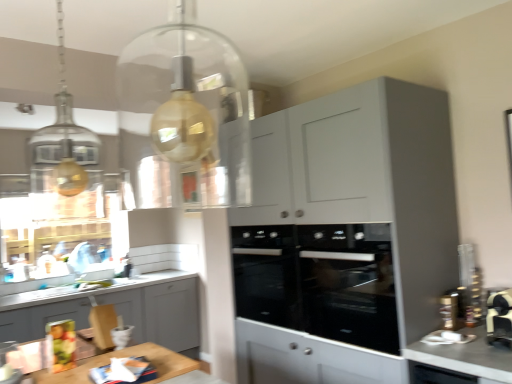
Question: Are matte gray cabinet at lower left, the 1th cabinetry when ordered from back to front, and white glossy countertop at lower right located far from each other?

Choices:
 (A) no
 (B) yes

Answer: (B)

Question: From a real-world perspective, does matte gray cabinet at lower left, the first cabinetry viewed from the left, sit lower than white glossy countertop at lower right?

Choices:
 (A) yes
 (B) no

Answer: (A)

Question: Is white glossy countertop at lower right a part of matte gray cabinet at lower left, the 1th cabinetry when ordered from back to front?

Choices:
 (A) no
 (B) yes

Answer: (A)

Question: Considering the relative sizes of matte gray cabinet at lower left, which ranks as the 2th cabinetry in right-to-left order, and white glossy countertop at lower right in the image provided, is matte gray cabinet at lower left, which ranks as the 2th cabinetry in right-to-left order, taller than white glossy countertop at lower right?

Choices:
 (A) no
 (B) yes

Answer: (B)

Question: Is matte gray cabinet at lower left, which ranks as the 2th cabinetry in right-to-left order, smaller than white glossy countertop at lower right?

Choices:
 (A) no
 (B) yes

Answer: (A)

Question: From a real-world perspective, relative to black glass oven at center, is black glass oven at center vertically above or below?

Choices:
 (A) above
 (B) below

Answer: (B)

Question: Does point (295, 306) appear closer or farther from the camera than point (330, 314)?

Choices:
 (A) closer
 (B) farther

Answer: (B)

Question: Is black glass oven at center taller or shorter than black glass oven at center?

Choices:
 (A) tall
 (B) short

Answer: (B)

Question: Considering the positions of black glass oven at center and black glass oven at center in the image, is black glass oven at center wider or thinner than black glass oven at center?

Choices:
 (A) wide
 (B) thin

Answer: (A)

Question: From a real-world perspective, is black glass oven at center above or below matte gray cabinet at lower left, the 1th cabinetry when ordered from back to front?

Choices:
 (A) below
 (B) above

Answer: (B)

Question: Considering the positions of point (312, 246) and point (52, 309), is point (312, 246) closer or farther from the camera than point (52, 309)?

Choices:
 (A) closer
 (B) farther

Answer: (A)

Question: From the image's perspective, is black glass oven at center located above or below matte gray cabinet at lower left, the first cabinetry viewed from the left?

Choices:
 (A) below
 (B) above

Answer: (B)

Question: Do you think black glass oven at center is within matte gray cabinet at lower left, the first cabinetry viewed from the left, or outside of it?

Choices:
 (A) inside
 (B) outside

Answer: (B)

Question: Does point (410, 350) appear closer or farther from the camera than point (141, 306)?

Choices:
 (A) closer
 (B) farther

Answer: (A)

Question: Is white glossy countertop at lower right bigger or smaller than matte gray cabinet at lower left, arranged as the second cabinetry when viewed from the front?

Choices:
 (A) big
 (B) small

Answer: (B)